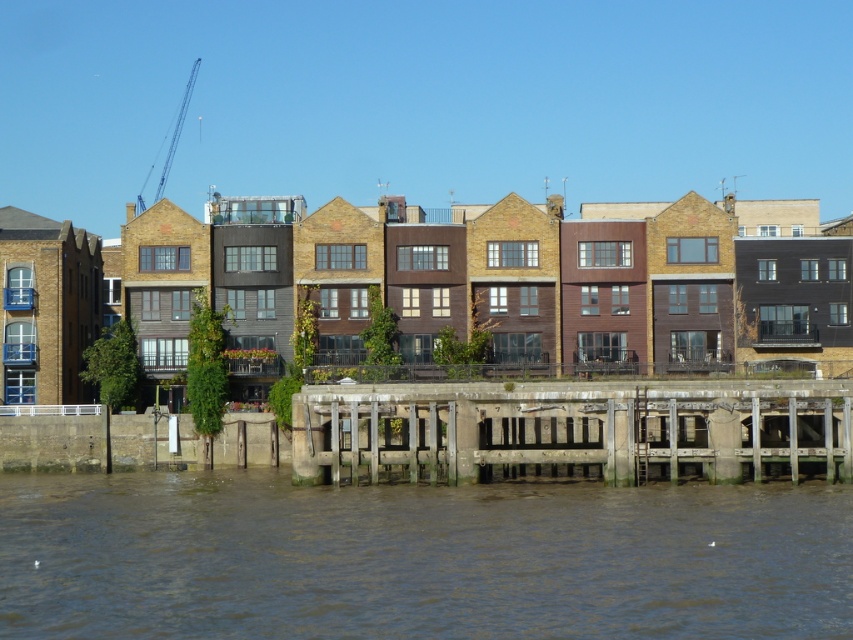
How distant is brown muddy water at lower center from blue metallic crane at upper left?

A distance of 155.68 meters exists between brown muddy water at lower center and blue metallic crane at upper left.

Which is above, brown muddy water at lower center or blue metallic crane at upper left?

blue metallic crane at upper left

Measure the distance between brown muddy water at lower center and camera.

brown muddy water at lower center and camera are 147.57 feet apart.

Image resolution: width=853 pixels, height=640 pixels. I want to click on brown muddy water at lower center, so click(418, 557).

Which is behind, point (776, 465) or point (195, 60)?

The point (195, 60) is behind.

Is point (723, 417) farther from camera compared to point (166, 161)?

That is False.

Where is `wooden planks at lower center`? The width and height of the screenshot is (853, 640). wooden planks at lower center is located at coordinates tap(573, 429).

Can you confirm if brown muddy water at lower center is positioned below wooden planks at lower center?

Indeed, brown muddy water at lower center is positioned under wooden planks at lower center.

Is point (227, 476) closer to camera compared to point (657, 381)?

No, it is not.

Where is `brown muddy water at lower center`? brown muddy water at lower center is located at coordinates (418, 557).